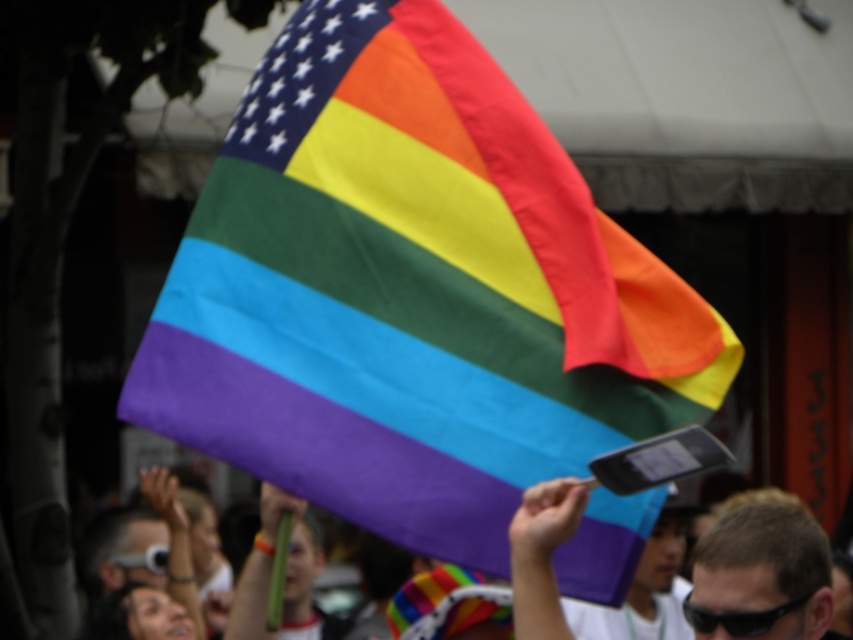
You are at the Pride parade and want to take a photo of the black plastic goggles at upper center without including the short brown hair at center in the frame. Which direction should you move your camera to the left or right?

Since the short brown hair at center is to the right of the black plastic goggles at upper center, you should move your camera to the right to exclude the short brown hair at center and focus on the black plastic goggles at upper center.

From the picture: You are a photographer at the Pride parade. You need to capture both the rainbow fabric flag at upper center and the black plastic goggles at upper center in your shot. Which object should you zoom in on to ensure both are clearly visible in the frame?

The rainbow fabric flag at upper center is larger than the black plastic goggles at upper center. To ensure both are clearly visible, you should zoom in on the smaller object, the black plastic goggles at upper center, so that the larger flag doesn not dominate the frame excessively.

You are a photographer standing at the parade. You want to capture the rainbow fabric flag at upper center in your shot. If your camera has a maximum focus range of 5 meters, will you be able to clearly photograph the flag from your current position?

The distance between the rainbow fabric flag at upper center and the camera is 5.65 meters, which exceeds the camera maximum focus range of 5 meters. Therefore, you won not be able to clearly photograph the flag from your current position.